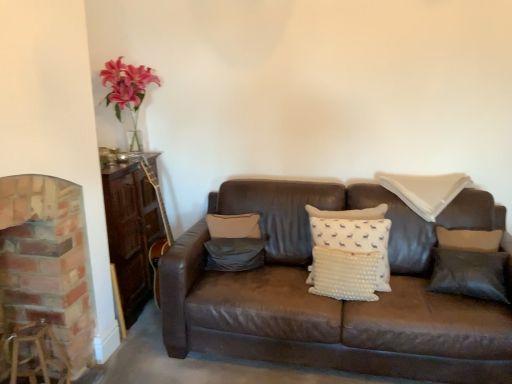
You are a GUI agent. You are given a task and a screenshot of the screen. Output one action in this format:
    pyautogui.click(x=<x>, y=<y>)
    Task: Click on the white dotted pillow at upper right, acting as the 2th pillow starting from the right
    This screenshot has height=384, width=512.
    Given the screenshot: What is the action you would take?
    pyautogui.click(x=425, y=191)

What do you see at coordinates (469, 274) in the screenshot?
I see `black leather pillow at right, arranged as the first pillow when viewed from the right` at bounding box center [469, 274].

In order to click on white dotted pillow at center, the 3th pillow in the right-to-left sequence in this screenshot , I will do `click(349, 213)`.

Where is `dark gray fabric pillow at center, the 1th pillow positioned from the left`? The width and height of the screenshot is (512, 384). dark gray fabric pillow at center, the 1th pillow positioned from the left is located at coordinates (234, 254).

The width and height of the screenshot is (512, 384). I want to click on bar stool below the black leather pillow at right, arranged as the fourth pillow when viewed from the left (from a real-world perspective), so coord(38,354).

How much distance is there between wooden bar stool at lower left and black leather pillow at right, arranged as the first pillow when viewed from the right?

The distance of wooden bar stool at lower left from black leather pillow at right, arranged as the first pillow when viewed from the right, is 6.55 feet.

Which is farther from the camera, [35,367] or [448,257]?

The point [448,257] is farther.

Is wooden bar stool at lower left far away from black leather pillow at right, arranged as the first pillow when viewed from the right?

Absolutely, wooden bar stool at lower left is distant from black leather pillow at right, arranged as the first pillow when viewed from the right.

Is point (389, 273) positioned behind point (234, 267)?

No, (389, 273) is closer to viewer.

From a real-world perspective, which object stands above the other?

From a 3D spatial view, white dotted pillow at center, which is the second pillow in left-to-right order, is above.

Is dark gray fabric pillow at center, marked as the fourth pillow in a right-to-left arrangement, completely or partially inside white dotted pillow at center, the 3th pillow in the right-to-left sequence?

No, dark gray fabric pillow at center, marked as the fourth pillow in a right-to-left arrangement, is not surrounded by white dotted pillow at center, the 3th pillow in the right-to-left sequence.

Is dark gray fabric pillow at center, marked as the fourth pillow in a right-to-left arrangement, at the back of white dotted pillow at center, the 3th pillow in the right-to-left sequence?

That's not correct — white dotted pillow at center, the 3th pillow in the right-to-left sequence, is not looking away from dark gray fabric pillow at center, marked as the fourth pillow in a right-to-left arrangement.

From the image's perspective, relative to brick fireplace at left, is white dotted pillow at upper right, acting as the 2th pillow starting from the right, above or below?

From the image's perspective, white dotted pillow at upper right, acting as the 2th pillow starting from the right, appears above brick fireplace at left.

Does white dotted pillow at upper right, the 3th pillow from the left, appear on the right side of brick fireplace at left?

Correct, you'll find white dotted pillow at upper right, the 3th pillow from the left, to the right of brick fireplace at left.

Is point (410, 194) in front of point (37, 232)?

No.

Between point (456, 290) and point (406, 187), which one is positioned in front?

The point (456, 290) is more forward.

From the picture: From a real-world perspective, is black leather pillow at right, arranged as the fourth pillow when viewed from the left, beneath white dotted pillow at upper right, the 3th pillow from the left?

Yes, from a real-world perspective, black leather pillow at right, arranged as the fourth pillow when viewed from the left, is below white dotted pillow at upper right, the 3th pillow from the left.

Does black leather pillow at right, arranged as the fourth pillow when viewed from the left, have a greater width compared to white dotted pillow at upper right, acting as the 2th pillow starting from the right?

Result: In fact, black leather pillow at right, arranged as the fourth pillow when viewed from the left, might be narrower than white dotted pillow at upper right, acting as the 2th pillow starting from the right.

This screenshot has width=512, height=384. I want to click on bar stool below the black leather pillow at right, arranged as the fourth pillow when viewed from the left (from the image's perspective), so click(38, 354).

Can you confirm if black leather pillow at right, arranged as the first pillow when viewed from the right, is shorter than wooden bar stool at lower left?

No, black leather pillow at right, arranged as the first pillow when viewed from the right, is not shorter than wooden bar stool at lower left.

Considering the relative positions of black leather pillow at right, arranged as the first pillow when viewed from the right, and wooden bar stool at lower left in the image provided, is black leather pillow at right, arranged as the first pillow when viewed from the right, to the left of wooden bar stool at lower left from the viewer's perspective?

Incorrect, black leather pillow at right, arranged as the first pillow when viewed from the right, is not on the left side of wooden bar stool at lower left.

Is black leather pillow at right, arranged as the first pillow when viewed from the right, positioned with its back to wooden bar stool at lower left?

No, black leather pillow at right, arranged as the first pillow when viewed from the right,'s orientation is not away from wooden bar stool at lower left.

Does brick fireplace at left have a larger size compared to dark gray fabric pillow at center, marked as the fourth pillow in a right-to-left arrangement?

Yes, brick fireplace at left is bigger than dark gray fabric pillow at center, marked as the fourth pillow in a right-to-left arrangement.

From a real-world perspective, is brick fireplace at left physically below dark gray fabric pillow at center, the 1th pillow positioned from the left?

No.

How many degrees apart are the facing directions of brick fireplace at left and dark gray fabric pillow at center, the 1th pillow positioned from the left?

There is a 72.8-degree angle between the facing directions of brick fireplace at left and dark gray fabric pillow at center, the 1th pillow positioned from the left.

From the image's perspective, is brick fireplace at left below dark gray fabric pillow at center, marked as the fourth pillow in a right-to-left arrangement?

Correct, brick fireplace at left appears lower than dark gray fabric pillow at center, marked as the fourth pillow in a right-to-left arrangement, in the image.

Based on the photo, is brick fireplace at left at the left side of black leather pillow at right, arranged as the first pillow when viewed from the right?

Yes, brick fireplace at left is to the left of black leather pillow at right, arranged as the first pillow when viewed from the right.

Can black leather pillow at right, arranged as the first pillow when viewed from the right, be found inside brick fireplace at left?

No, black leather pillow at right, arranged as the first pillow when viewed from the right, is not surrounded by brick fireplace at left.

From a real-world perspective, is brick fireplace at left positioned above or below black leather pillow at right, arranged as the fourth pillow when viewed from the left?

Clearly, from a real-world perspective, brick fireplace at left is above black leather pillow at right, arranged as the fourth pillow when viewed from the left.

Does brick fireplace at left come in front of black leather pillow at right, arranged as the fourth pillow when viewed from the left?

Yes.

At what (x,y) coordinates should I click in order to perform the action: click on bar stool below the black leather pillow at right, arranged as the fourth pillow when viewed from the left (from a real-world perspective). Please return your answer as a coordinate pair (x, y). Image resolution: width=512 pixels, height=384 pixels. Looking at the image, I should click on (38, 354).

The height and width of the screenshot is (384, 512). I want to click on pillow that is on the left side of white dotted pillow at center, the 3th pillow in the right-to-left sequence, so click(234, 254).

Consider the image. Based on their spatial positions, is white dotted pillow at center, the 3th pillow in the right-to-left sequence, or brick fireplace at left further from black leather pillow at right, arranged as the fourth pillow when viewed from the left?

Based on the image, brick fireplace at left appears to be further to black leather pillow at right, arranged as the fourth pillow when viewed from the left.

From the image, which object appears to be nearer to brick fireplace at left, black leather pillow at right, arranged as the first pillow when viewed from the right, or wooden bar stool at lower left?

Among the two, wooden bar stool at lower left is located nearer to brick fireplace at left.

Looking at the image, which one is located closer to white dotted pillow at upper right, the 3th pillow from the left, dark gray fabric pillow at center, marked as the fourth pillow in a right-to-left arrangement, or white dotted pillow at center, the 3th pillow in the right-to-left sequence?

Based on the image, white dotted pillow at center, the 3th pillow in the right-to-left sequence, appears to be nearer to white dotted pillow at upper right, the 3th pillow from the left.

Based on their spatial positions, is white dotted pillow at upper right, the 3th pillow from the left, or white dotted pillow at center, which is the second pillow in left-to-right order, further from black leather pillow at right, arranged as the first pillow when viewed from the right?

white dotted pillow at center, which is the second pillow in left-to-right order, is further to black leather pillow at right, arranged as the first pillow when viewed from the right.

Looking at the image, which one is located further to white dotted pillow at upper right, the 3th pillow from the left, dark gray fabric pillow at center, the 1th pillow positioned from the left, or brick fireplace at left?

Among the two, brick fireplace at left is located further to white dotted pillow at upper right, the 3th pillow from the left.

Considering their positions, is black leather pillow at right, arranged as the fourth pillow when viewed from the left, positioned further to white dotted pillow at upper right, the 3th pillow from the left, than white dotted pillow at center, the 3th pillow in the right-to-left sequence?

black leather pillow at right, arranged as the fourth pillow when viewed from the left, lies further to white dotted pillow at upper right, the 3th pillow from the left, than the other object.

From the picture: Looking at the image, which one is located further to white dotted pillow at center, the 3th pillow in the right-to-left sequence, brick fireplace at left or black leather pillow at right, arranged as the first pillow when viewed from the right?

Among the two, brick fireplace at left is located further to white dotted pillow at center, the 3th pillow in the right-to-left sequence.

Based on their spatial positions, is black leather pillow at right, arranged as the first pillow when viewed from the right, or white dotted pillow at upper right, acting as the 2th pillow starting from the right, further from brick fireplace at left?

black leather pillow at right, arranged as the first pillow when viewed from the right.

At what (x,y) coordinates should I click in order to perform the action: click on pillow located between dark gray fabric pillow at center, the 1th pillow positioned from the left, and white dotted pillow at upper right, acting as the 2th pillow starting from the right, in the left-right direction. Please return your answer as a coordinate pair (x, y). Image resolution: width=512 pixels, height=384 pixels. Looking at the image, I should click on (349, 213).

The height and width of the screenshot is (384, 512). I want to click on pillow between white dotted pillow at center, which is the second pillow in left-to-right order, and black leather pillow at right, arranged as the fourth pillow when viewed from the left, so click(x=425, y=191).

Image resolution: width=512 pixels, height=384 pixels. In order to click on pillow situated between wooden bar stool at lower left and white dotted pillow at center, which is the second pillow in left-to-right order, from left to right in this screenshot , I will do `click(234, 254)`.

Where is `bar stool between brick fireplace at left and white dotted pillow at upper right, acting as the 2th pillow starting from the right, in the horizontal direction`? Image resolution: width=512 pixels, height=384 pixels. bar stool between brick fireplace at left and white dotted pillow at upper right, acting as the 2th pillow starting from the right, in the horizontal direction is located at coordinates (38, 354).